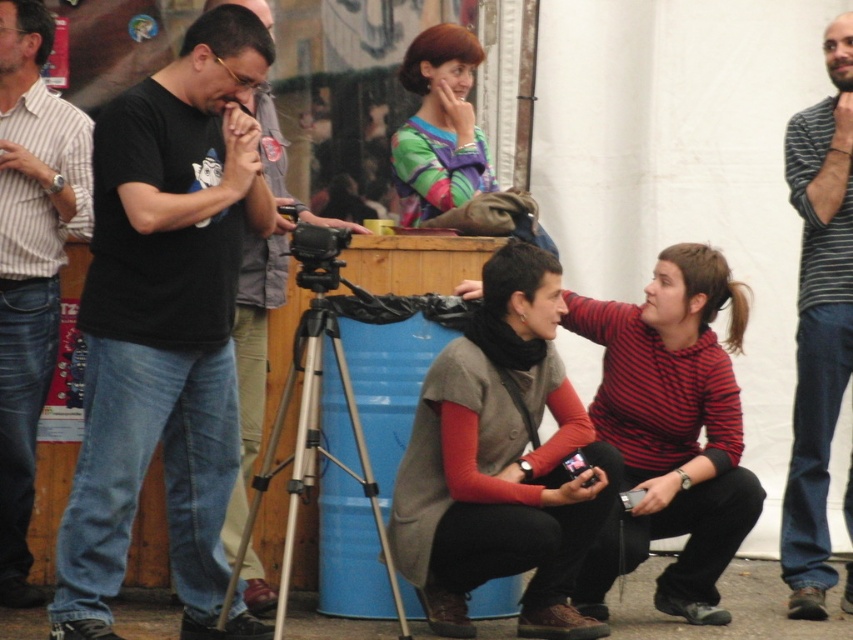
You are a photographer trying to capture a group photo of the striped cotton shirt at left and the striped cotton shirt at right. Which one should you focus on first if you want to ensure both are in focus?

The striped cotton shirt at left is above the striped cotton shirt at right, so focusing on the one at left first will help ensure both are in focus as they are at different heights.

You are a photographer who needs to choose between the black matte camera at left and the black plastic video camera at center for a project requiring a taller device. Which camera should you select?

The black matte camera at left is much taller than the black plastic video camera at center, so you should select the black matte camera at left for your project.

You are a photographer trying to decide which camera to use for capturing a wide group shot. The black matte camera at left and the black plastic video camera at center are available. Based on their sizes, which camera might be more suitable for this task?

The black matte camera at left has a larger size compared to the black plastic video camera at center, so it might be more suitable for capturing a wide group shot due to its larger sensor and lens capabilities.